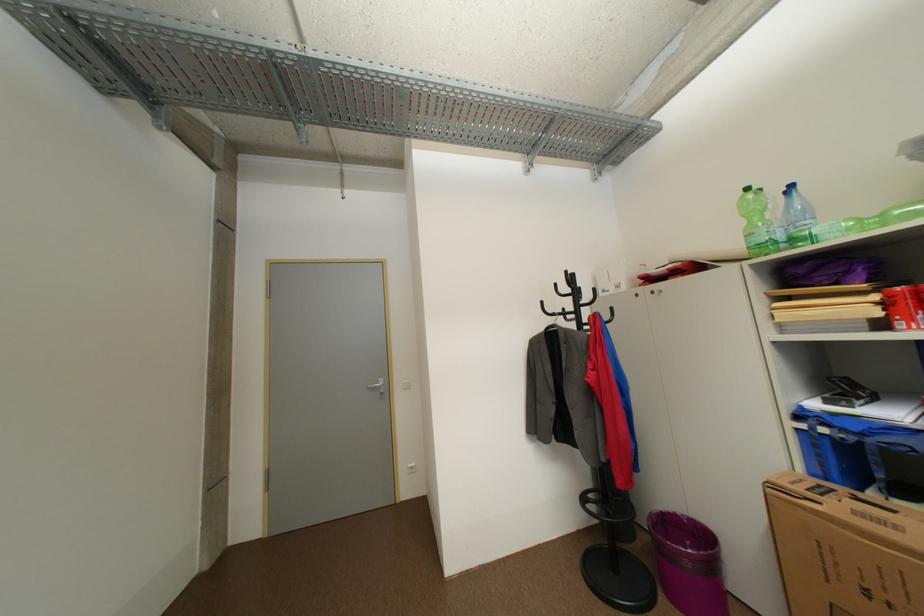
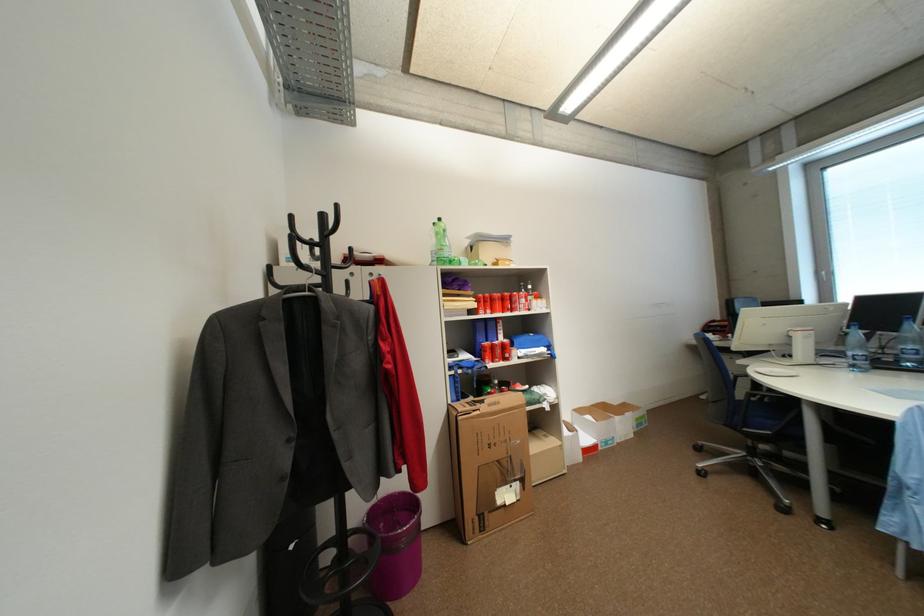
Find the pixel in the second image that matches point (894, 304) in the first image.

(485, 302)